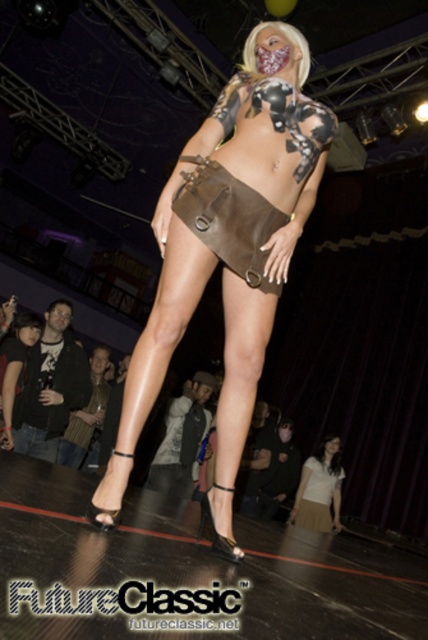
Is matte brown leather skirt at center closer to the viewer compared to white matte skirt at lower center?

Yes.

Image resolution: width=428 pixels, height=640 pixels. What do you see at coordinates (228, 250) in the screenshot?
I see `matte brown leather skirt at center` at bounding box center [228, 250].

You are a GUI agent. You are given a task and a screenshot of the screen. Output one action in this format:
    pyautogui.click(x=<x>, y=<y>)
    Task: Click on the matte brown leather skirt at center
    The image size is (428, 640).
    Given the screenshot: What is the action you would take?
    pyautogui.click(x=228, y=250)

Which is in front, point (89, 518) or point (187, 189)?

Point (89, 518) is in front.

Who is more forward, (101,493) or (187,195)?

Point (101,493)

Locate an element on the screen. The height and width of the screenshot is (640, 428). matte brown leather skirt at center is located at coordinates (228, 250).

Is point (228, 173) in front of point (291, 509)?

Yes, it is in front of point (291, 509).

Consider the image. Who is lower down, brown leather skirt at center or white matte skirt at lower center?

white matte skirt at lower center

Who is more forward, [234,234] or [336,470]?

Positioned in front is point [234,234].

Find the location of a particular element. The width and height of the screenshot is (428, 640). brown leather skirt at center is located at coordinates [x=228, y=220].